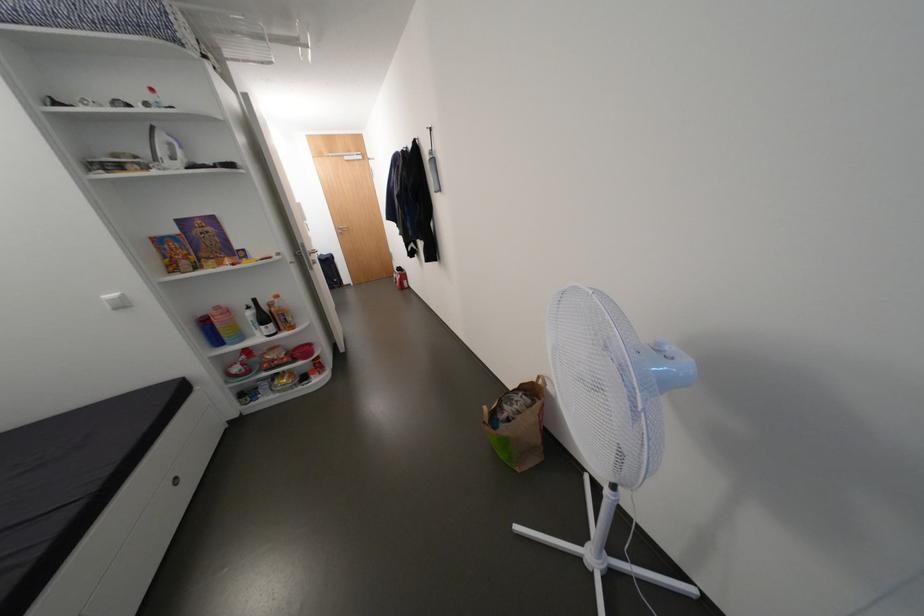
What do you see at coordinates (345, 230) in the screenshot?
I see `the silver door handle` at bounding box center [345, 230].